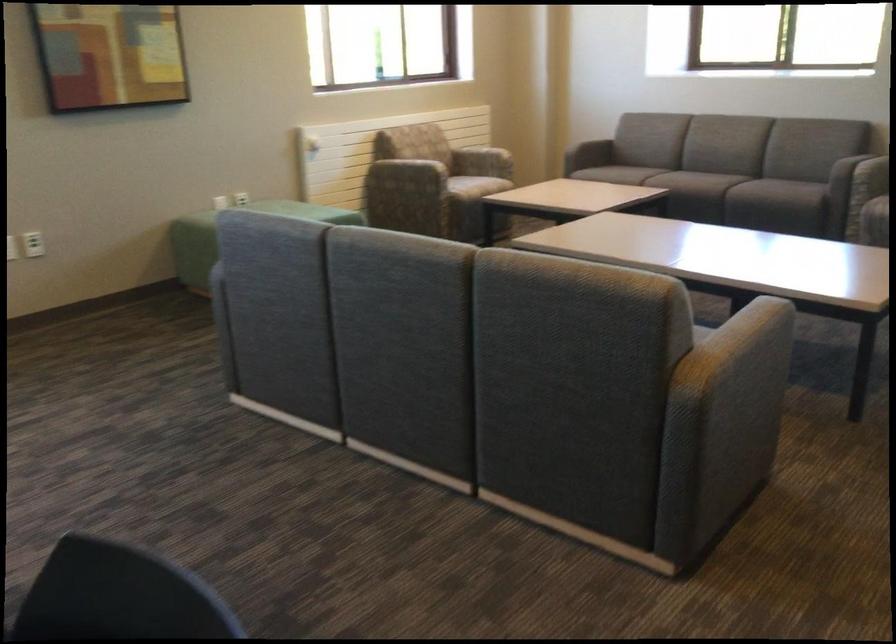
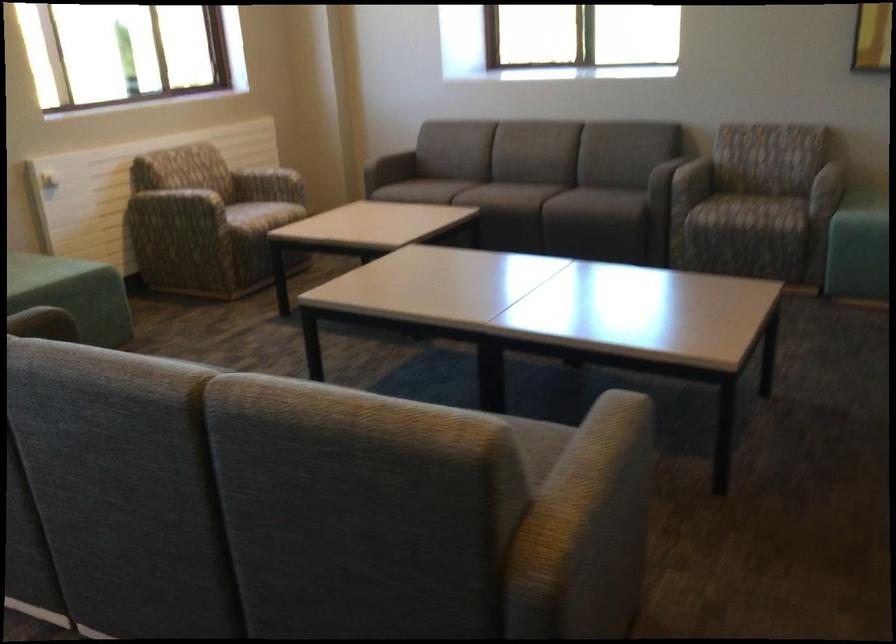
Find the pixel in the second image that matches point (409, 165) in the first image.

(179, 204)